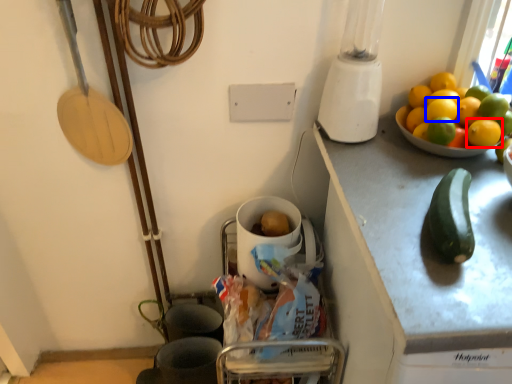
Question: Which object is further to the camera taking this photo, lemon (highlighted by a red box) or lemon (highlighted by a blue box)?

Choices:
 (A) lemon
 (B) lemon

Answer: (B)